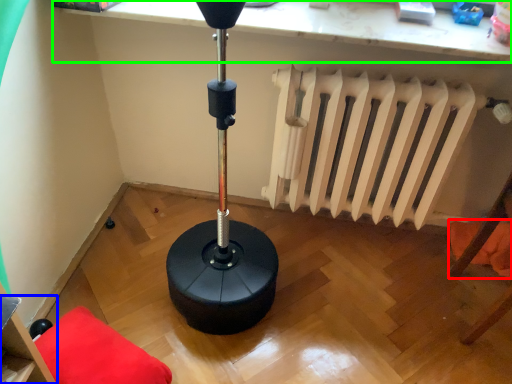
Question: Estimate the real-world distances between objects in this image. Which object is farther from pillow (highlighted by a red box), furniture (highlighted by a blue box) or computer (highlighted by a green box)?

Choices:
 (A) furniture
 (B) computer

Answer: (A)